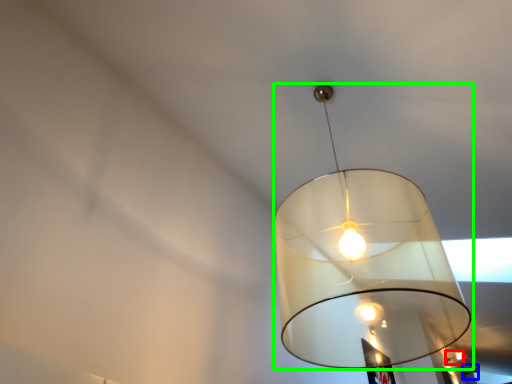
Question: Which is nearer to the lamp (highlighted by a red box)? lamp (highlighted by a blue box) or lamp (highlighted by a green box).

Choices:
 (A) lamp
 (B) lamp

Answer: (A)